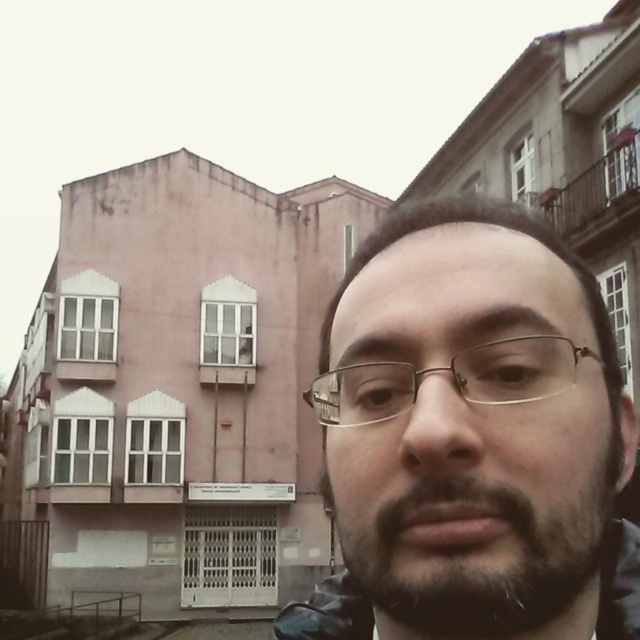
Does dark brown hair at upper center have a greater width compared to dark brown stubble at center?

Indeed, dark brown hair at upper center has a greater width compared to dark brown stubble at center.

Is dark brown hair at upper center thinner than dark brown stubble at center?

Incorrect, dark brown hair at upper center's width is not less than dark brown stubble at center's.

Find the location of a particular element. dark brown hair at upper center is located at coordinates (472, 436).

Can you confirm if dark brown stubble at center is positioned below metallic gold glasses at center?

Correct, dark brown stubble at center is located below metallic gold glasses at center.

Does dark brown stubble at center come behind metallic gold glasses at center?

No.

Describe the element at coordinates (481, 572) in the screenshot. I see `dark brown stubble at center` at that location.

Identify the location of dark brown stubble at center. (481, 572).

From the picture: Can you confirm if dark brown hair at upper center is positioned to the left of metallic gold glasses at center?

In fact, dark brown hair at upper center is to the right of metallic gold glasses at center.

Does dark brown hair at upper center have a smaller size compared to metallic gold glasses at center?

Incorrect, dark brown hair at upper center is not smaller in size than metallic gold glasses at center.

Is point (369, 461) closer to camera compared to point (392, 397)?

That is True.

The height and width of the screenshot is (640, 640). I want to click on dark brown hair at upper center, so coord(472,436).